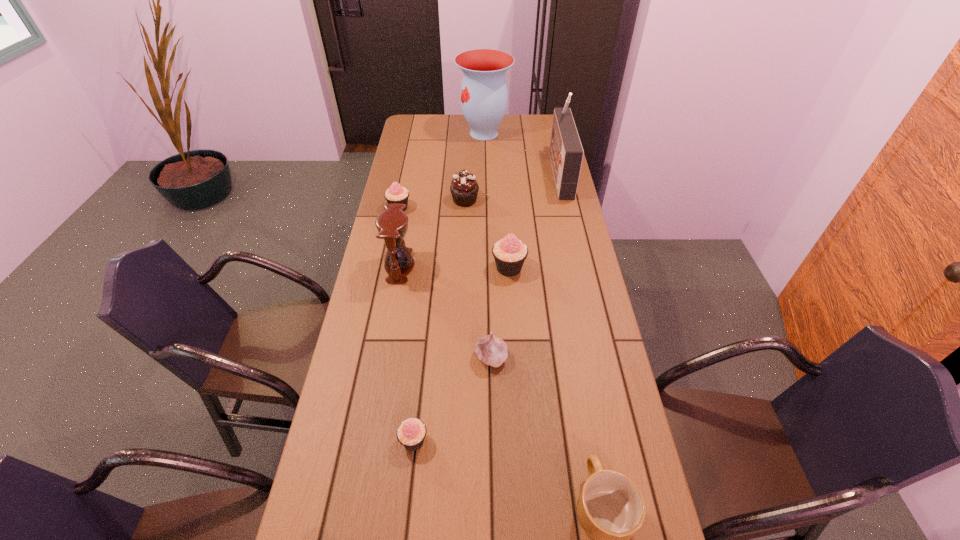
Identify the location of free space located on the right of the brown cupcake. Image resolution: width=960 pixels, height=540 pixels. (543, 200).

Locate an element on the screen. vacant space located 0.380m on the right of the leftmost cupcake is located at coordinates (507, 207).

I want to click on free space located 0.230m on the left of the garlic, so click(394, 357).

Where is `vacant space located 0.170m on the front of the third object from left to right`? vacant space located 0.170m on the front of the third object from left to right is located at coordinates (403, 535).

Locate an element on the screen. object that is at the far edge is located at coordinates (484, 97).

Identify the location of hourglass present at the left edge. (392, 224).

At what (x,y) coordinates should I click in order to perform the action: click on cupcake present at the left edge. Please return your answer as a coordinate pair (x, y). This screenshot has width=960, height=540. Looking at the image, I should click on (395, 194).

Find the location of a particular element. This screenshot has width=960, height=540. object that is at the right edge is located at coordinates (566, 153).

Where is `free space at the far edge of the desktop`? The image size is (960, 540). free space at the far edge of the desktop is located at coordinates (515, 114).

Find the location of a particular element. vacant space at the left edge is located at coordinates (418, 201).